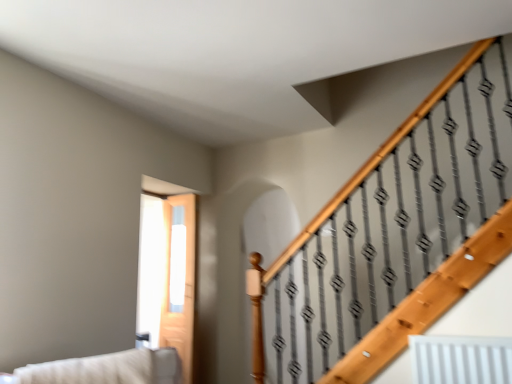
I want to click on beige fabric couch at lower left, so click(106, 369).

This screenshot has height=384, width=512. Describe the element at coordinates (106, 369) in the screenshot. I see `beige fabric couch at lower left` at that location.

Find the location of a particular element. clear glass door at center is located at coordinates (179, 279).

What do you see at coordinates (179, 279) in the screenshot?
I see `clear glass door at center` at bounding box center [179, 279].

Locate an element on the screen. Image resolution: width=512 pixels, height=384 pixels. beige fabric couch at lower left is located at coordinates (106, 369).

Is clear glass door at center at the right side of beige fabric couch at lower left?

Indeed, clear glass door at center is positioned on the right side of beige fabric couch at lower left.

Which object is closer to the camera taking this photo, clear glass door at center or beige fabric couch at lower left?

beige fabric couch at lower left is closer to the camera.

Which is in front, point (169, 259) or point (61, 362)?

Point (61, 362)

Based on the photo, from the image's perspective, is clear glass door at center positioned above or below beige fabric couch at lower left?

Based on their image positions, clear glass door at center is located beneath beige fabric couch at lower left.

From a real-world perspective, does clear glass door at center sit lower than beige fabric couch at lower left?

No.

Is clear glass door at center wider than beige fabric couch at lower left?

Incorrect, the width of clear glass door at center does not surpass that of beige fabric couch at lower left.

Is clear glass door at center taller than beige fabric couch at lower left?

Indeed, clear glass door at center has a greater height compared to beige fabric couch at lower left.

Does clear glass door at center have a larger size compared to beige fabric couch at lower left?

No, clear glass door at center is not bigger than beige fabric couch at lower left.

Is clear glass door at center not inside beige fabric couch at lower left?

Indeed, clear glass door at center is completely outside beige fabric couch at lower left.

Based on the photo, is clear glass door at center far from beige fabric couch at lower left?

clear glass door at center is far away from beige fabric couch at lower left.

Is clear glass door at center oriented away from beige fabric couch at lower left?

That's not correct — clear glass door at center is not looking away from beige fabric couch at lower left.

In the image, there is a clear glass door at center. What are the coordinates of `couch above it (from the image's perspective)` in the screenshot? It's located at (106, 369).

In the image, is beige fabric couch at lower left on the left side or the right side of clear glass door at center?

Clearly, beige fabric couch at lower left is on the left of clear glass door at center in the image.

Which object is further away from the camera taking this photo, beige fabric couch at lower left or clear glass door at center?

clear glass door at center is more distant.

Which is nearer, (143, 359) or (195, 262)?

The point (143, 359) is more forward.

From the image's perspective, between beige fabric couch at lower left and clear glass door at center, which one is located above?

beige fabric couch at lower left.

From a real-world perspective, is beige fabric couch at lower left positioned over clear glass door at center based on gravity?

No.

Considering the relative sizes of beige fabric couch at lower left and clear glass door at center in the image provided, is beige fabric couch at lower left wider than clear glass door at center?

Yes.

In terms of height, does beige fabric couch at lower left look taller or shorter compared to clear glass door at center?

In the image, beige fabric couch at lower left appears to be shorter than clear glass door at center.

Considering the sizes of objects beige fabric couch at lower left and clear glass door at center in the image provided, who is smaller, beige fabric couch at lower left or clear glass door at center?

Smaller between the two is clear glass door at center.

Would you say beige fabric couch at lower left contains clear glass door at center?

Definitely not — clear glass door at center is not inside beige fabric couch at lower left.

Are beige fabric couch at lower left and clear glass door at center beside each other?

No, beige fabric couch at lower left is not in contact with clear glass door at center.

Is clear glass door at center at the back of beige fabric couch at lower left?

Absolutely, beige fabric couch at lower left is directed away from clear glass door at center.

What's the angular difference between beige fabric couch at lower left and clear glass door at center's facing directions?

beige fabric couch at lower left and clear glass door at center are facing 49.4 degrees away from each other.

Locate an element on the screen. The height and width of the screenshot is (384, 512). screen door behind the beige fabric couch at lower left is located at coordinates (179, 279).

This screenshot has width=512, height=384. Identify the location of couch in front of the clear glass door at center. (106, 369).

This screenshot has width=512, height=384. I want to click on couch on the left of clear glass door at center, so click(x=106, y=369).